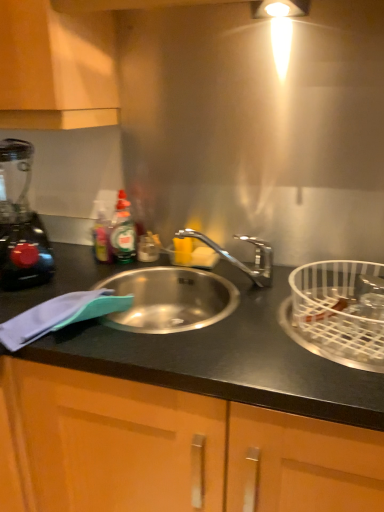
Question: Is black plastic blender at left far away from white wire basket at right?

Choices:
 (A) yes
 (B) no

Answer: (B)

Question: Could you tell me if black plastic blender at left is turned towards white wire basket at right?

Choices:
 (A) no
 (B) yes

Answer: (A)

Question: Does black plastic blender at left have a smaller size compared to white wire basket at right?

Choices:
 (A) no
 (B) yes

Answer: (B)

Question: Does black plastic blender at left have a greater width compared to white wire basket at right?

Choices:
 (A) no
 (B) yes

Answer: (A)

Question: Considering the relative sizes of black plastic blender at left and white wire basket at right in the image provided, is black plastic blender at left bigger than white wire basket at right?

Choices:
 (A) yes
 (B) no

Answer: (B)

Question: Relative to black matte countertop at left, is matte wood cabinet at upper left in front or behind?

Choices:
 (A) behind
 (B) front

Answer: (A)

Question: Considering the relative positions of matte wood cabinet at upper left and black matte countertop at left in the image provided, is matte wood cabinet at upper left to the left or to the right of black matte countertop at left?

Choices:
 (A) left
 (B) right

Answer: (A)

Question: Considering the positions of matte wood cabinet at upper left and black matte countertop at left in the image, is matte wood cabinet at upper left bigger or smaller than black matte countertop at left?

Choices:
 (A) small
 (B) big

Answer: (A)

Question: From a real-world perspective, is matte wood cabinet at upper left physically located above or below black matte countertop at left?

Choices:
 (A) above
 (B) below

Answer: (A)

Question: From the image's perspective, is matte wood cabinet at upper left located above or below black plastic blender at left?

Choices:
 (A) above
 (B) below

Answer: (A)

Question: Relative to black plastic blender at left, is matte wood cabinet at upper left in front or behind?

Choices:
 (A) behind
 (B) front

Answer: (B)

Question: Choose the correct answer: Is matte wood cabinet at upper left inside black plastic blender at left or outside it?

Choices:
 (A) inside
 (B) outside

Answer: (B)

Question: From their relative heights in the image, would you say matte wood cabinet at upper left is taller or shorter than black plastic blender at left?

Choices:
 (A) short
 (B) tall

Answer: (A)

Question: Looking at the image, does black matte countertop at left seem bigger or smaller compared to black plastic blender at left?

Choices:
 (A) big
 (B) small

Answer: (A)

Question: In terms of width, does black matte countertop at left look wider or thinner when compared to black plastic blender at left?

Choices:
 (A) wide
 (B) thin

Answer: (A)